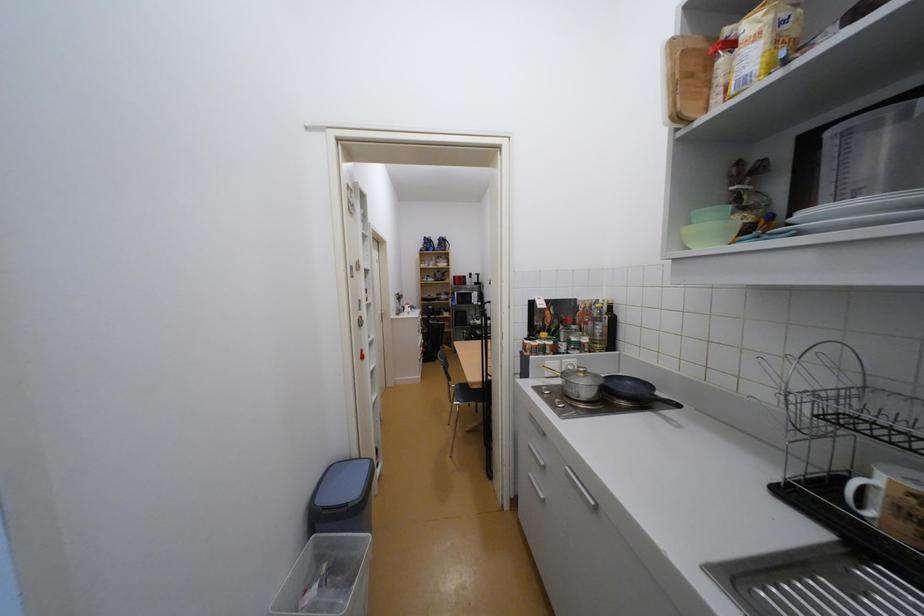
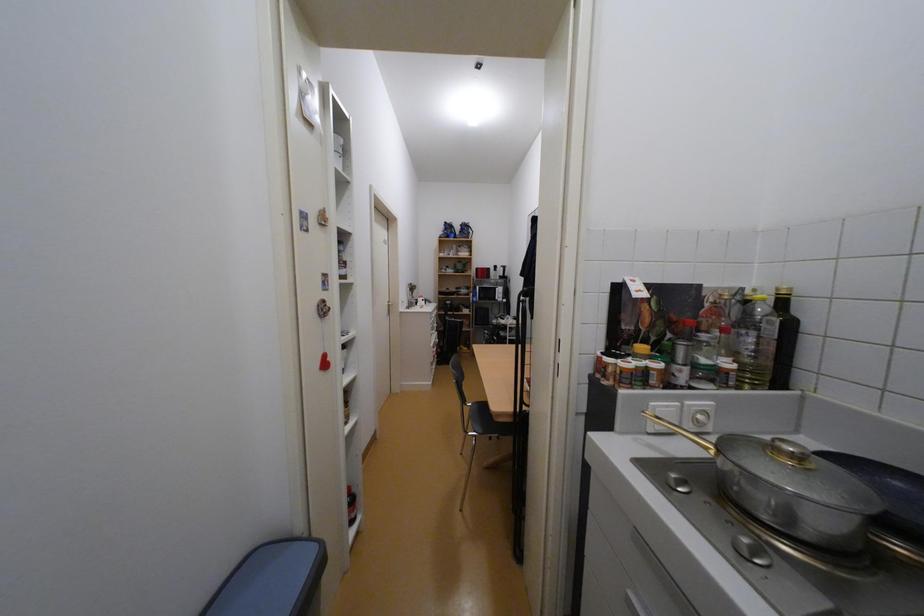
Question: Which direction would the cameraman need to move to produce the second image? Reply with the corresponding letter.

Choices:
 (A) Left
 (B) Right
 (C) Forward
 (D) Backward

Answer: (C)